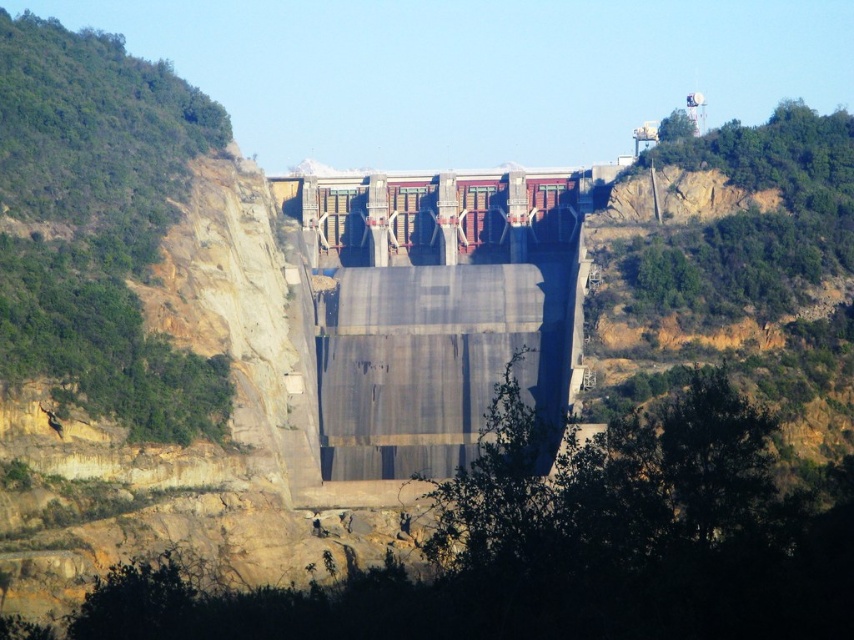
Measure the distance between point (332, 333) and camera.

Point (332, 333) is 624.25 feet away from camera.

Can you confirm if gray concrete dam at center is wider than smooth concrete dam at center?

Yes, gray concrete dam at center is wider than smooth concrete dam at center.

From the picture: Measure the distance between gray concrete dam at center and camera.

gray concrete dam at center and camera are 167.89 meters apart.

Identify the location of gray concrete dam at center. [x=436, y=308].